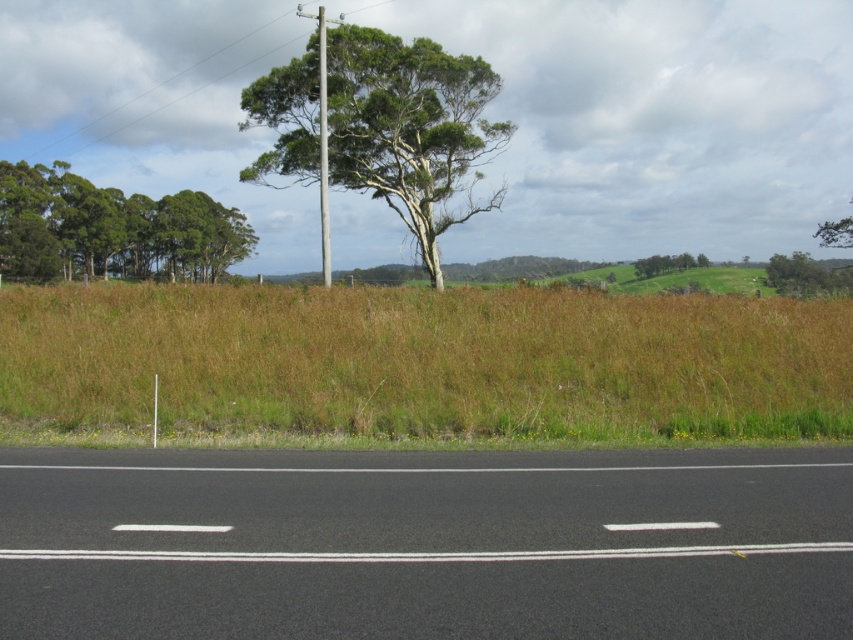
You are a gardener standing at the edge of the road. You see the brown dry grass at center and the smooth gray pole at center. Which object is closer to the ground?

The brown dry grass at center is located below smooth gray pole at center, so the brown dry grass at center is closer to the ground.

You are a photographer setting up a shot of the rural landscape. You want to ensure the smooth gray pole at center and the green leafy tree at upper center are both in the frame. Based on their positions, which object is closer to the camera?

The smooth gray pole at center is positioned over the green leafy tree at upper center, meaning it is closer to the camera.